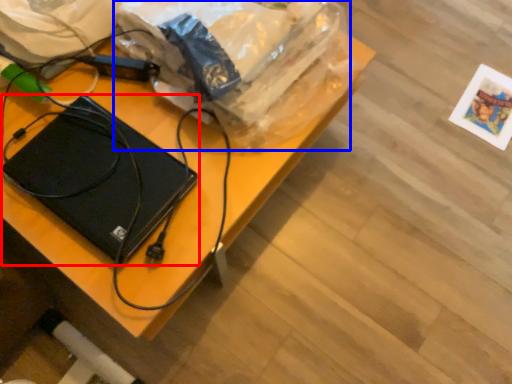
Question: Which point is further to the camera, laptop (highlighted by a red box) or grocery bag (highlighted by a blue box)?

Choices:
 (A) laptop
 (B) grocery bag

Answer: (A)